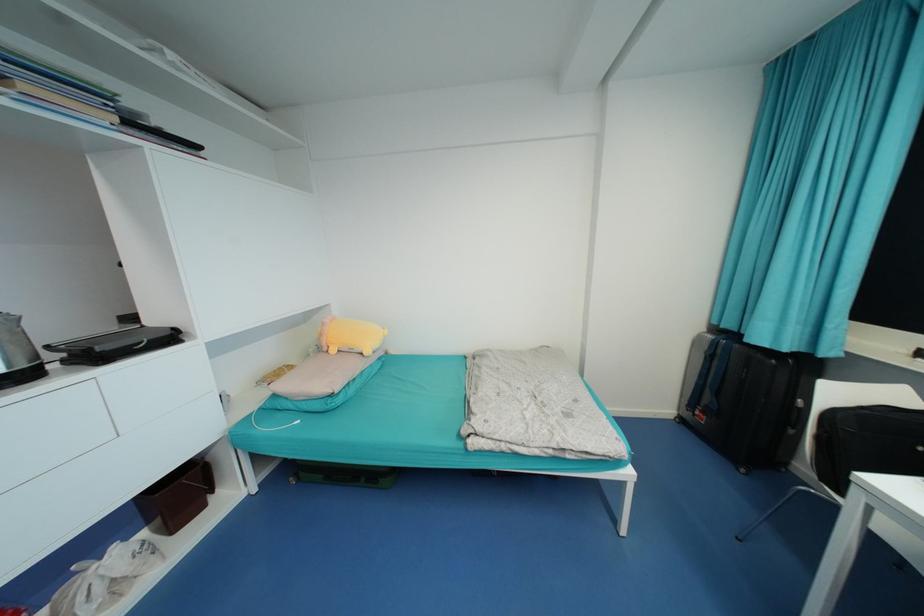
Find the location of a particular element. This screenshot has height=616, width=924. pink long pillow is located at coordinates (349, 334).